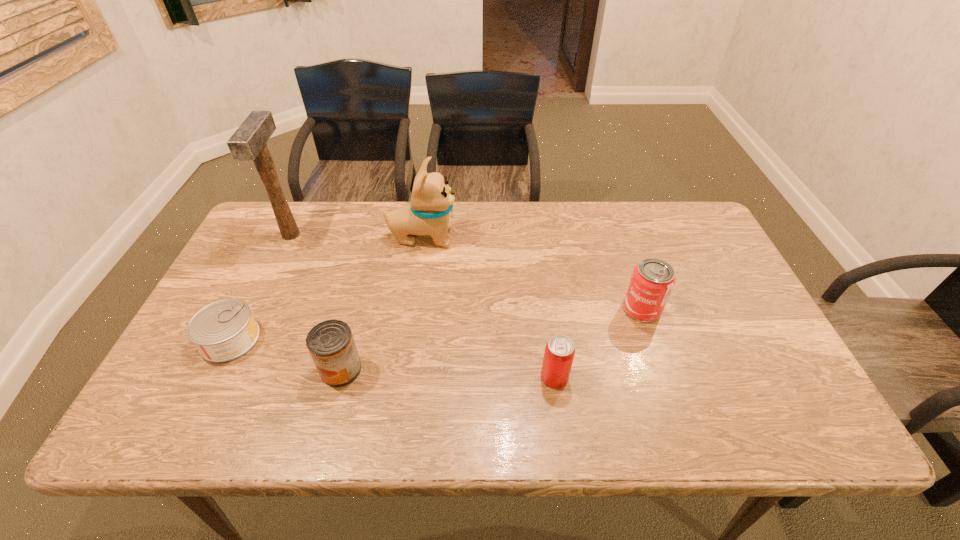
You are a GUI agent. You are given a task and a screenshot of the screen. Output one action in this format:
    pyautogui.click(x=<x>, y=<y>)
    Task: Click on the tallest object
    The height and width of the screenshot is (540, 960).
    Given the screenshot: What is the action you would take?
    pyautogui.click(x=248, y=143)

This screenshot has height=540, width=960. I want to click on puppy, so click(432, 199).

Image resolution: width=960 pixels, height=540 pixels. What are the coordinates of `the rightmost can` in the screenshot? It's located at (652, 280).

I want to click on the third can from right to left, so click(x=331, y=345).

I want to click on the second can from right to left, so click(559, 353).

Identify the location of the shortest can. This screenshot has height=540, width=960. (224, 330).

Find the location of a particular element. the leftmost can is located at coordinates (224, 330).

At what (x,y) coordinates should I click in order to perform the action: click on free location located 0.350m on the right of the tallest object. Please return your answer as a coordinate pair (x, y). The height and width of the screenshot is (540, 960). Looking at the image, I should click on (412, 235).

At what (x,y) coordinates should I click in order to perform the action: click on vacant space located 0.290m on the face of the puppy. Please return your answer as a coordinate pair (x, y). The image size is (960, 540). Looking at the image, I should click on (550, 237).

This screenshot has height=540, width=960. I want to click on vacant point located 0.300m on the back of the rightmost can, so click(613, 226).